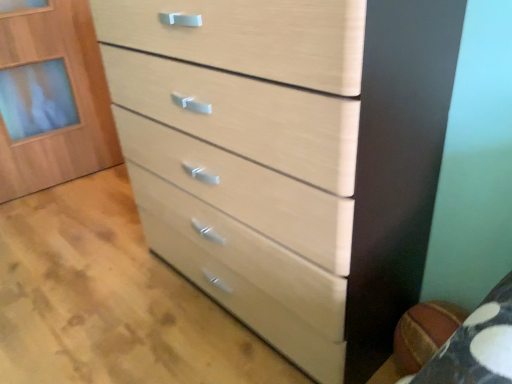
From the picture: Measure the distance between point [217,289] and camera.

Point [217,289] and camera are 1.37 meters apart.

Find the location of a particular element. Image resolution: width=512 pixels, height=384 pixels. light wood/texture chest of drawers at center is located at coordinates (289, 158).

The height and width of the screenshot is (384, 512). I want to click on light wood drawer at center, so click(x=245, y=275).

From the picture: Considering the sizes of objects light wood drawer at center and light wood cabinet at upper left in the image provided, who is wider, light wood drawer at center or light wood cabinet at upper left?

Wider between the two is light wood drawer at center.

In the scene shown: Is light wood drawer at center further to the viewer compared to light wood cabinet at upper left?

No, light wood drawer at center is closer to the camera.

Is light wood drawer at center spatially inside light wood cabinet at upper left, or outside of it?

light wood drawer at center is not inside light wood cabinet at upper left, it's outside.

Considering the sizes of objects light wood drawer at center and light wood/texture chest of drawers at center in the image provided, who is shorter, light wood drawer at center or light wood/texture chest of drawers at center?

With less height is light wood drawer at center.

From a real-world perspective, which object stands above the other?

light wood/texture chest of drawers at center is physically above.

Between light wood drawer at center and light wood/texture chest of drawers at center, which one has larger width?

light wood drawer at center.

Is light wood cabinet at upper left inside or outside of light wood/texture chest of drawers at center?

The correct answer is: outside.

Does light wood cabinet at upper left touch light wood/texture chest of drawers at center?

No, light wood cabinet at upper left is not beside light wood/texture chest of drawers at center.

Is light wood cabinet at upper left facing away from light wood/texture chest of drawers at center?

light wood cabinet at upper left is not turned away from light wood/texture chest of drawers at center.

Which is behind, light wood cabinet at upper left or light wood/texture chest of drawers at center?

light wood cabinet at upper left.

Which point is more forward, (304, 322) or (127, 164)?

Point (304, 322)

Considering the relative sizes of light wood/texture chest of drawers at center and light wood drawer at center in the image provided, is light wood/texture chest of drawers at center shorter than light wood drawer at center?

No.

Measure the distance between light wood/texture chest of drawers at center and light wood drawer at center.

They are 5.58 inches apart.

From the image's perspective, who appears lower, light wood/texture chest of drawers at center or light wood drawer at center?

light wood drawer at center appears lower in the image.

From the picture: Considering the sizes of objects light wood cabinet at upper left and light wood drawer at center in the image provided, who is shorter, light wood cabinet at upper left or light wood drawer at center?

light wood drawer at center.

Between light wood cabinet at upper left and light wood drawer at center, which one has larger width?

light wood drawer at center.

From the image's perspective, is light wood cabinet at upper left located above light wood drawer at center?

Correct, light wood cabinet at upper left appears higher than light wood drawer at center in the image.

Can you confirm if light wood cabinet at upper left is bigger than light wood drawer at center?

Incorrect, light wood cabinet at upper left is not larger than light wood drawer at center.

From a real-world perspective, is light wood/texture chest of drawers at center beneath light wood cabinet at upper left?

No, from a real-world perspective, light wood/texture chest of drawers at center is not under light wood cabinet at upper left.

Is light wood/texture chest of drawers at center inside the boundaries of light wood cabinet at upper left, or outside?

light wood/texture chest of drawers at center is not inside light wood cabinet at upper left, it's outside.

Based on the photo, is light wood/texture chest of drawers at center bigger or smaller than light wood cabinet at upper left?

In the image, light wood/texture chest of drawers at center appears to be larger than light wood cabinet at upper left.

How distant is light wood/texture chest of drawers at center from light wood cabinet at upper left?

A distance of 1.37 meters exists between light wood/texture chest of drawers at center and light wood cabinet at upper left.

I want to click on drawer on the right of light wood cabinet at upper left, so click(x=245, y=275).

Locate an element on the screen. The height and width of the screenshot is (384, 512). drawer that appears behind the light wood/texture chest of drawers at center is located at coordinates (245, 275).

Which object lies nearer to the anchor point light wood drawer at center, light wood cabinet at upper left or light wood/texture chest of drawers at center?

The object closer to light wood drawer at center is light wood/texture chest of drawers at center.

Estimate the real-world distances between objects in this image. Which object is further from light wood cabinet at upper left, light wood/texture chest of drawers at center or light wood drawer at center?

Among the two, light wood/texture chest of drawers at center is located further to light wood cabinet at upper left.

Considering their positions, is light wood drawer at center positioned closer to light wood/texture chest of drawers at center than light wood cabinet at upper left?

The object closer to light wood/texture chest of drawers at center is light wood drawer at center.

Estimate the real-world distances between objects in this image. Which object is further from light wood drawer at center, light wood/texture chest of drawers at center or light wood cabinet at upper left?

light wood cabinet at upper left.

Looking at the image, which one is located further to light wood cabinet at upper left, light wood drawer at center or light wood/texture chest of drawers at center?

light wood/texture chest of drawers at center.

From the image, which object appears to be nearer to light wood/texture chest of drawers at center, light wood cabinet at upper left or light wood drawer at center?

The object closer to light wood/texture chest of drawers at center is light wood drawer at center.

Locate an element on the screen. Image resolution: width=512 pixels, height=384 pixels. drawer positioned between light wood/texture chest of drawers at center and light wood cabinet at upper left from near to far is located at coordinates (245, 275).